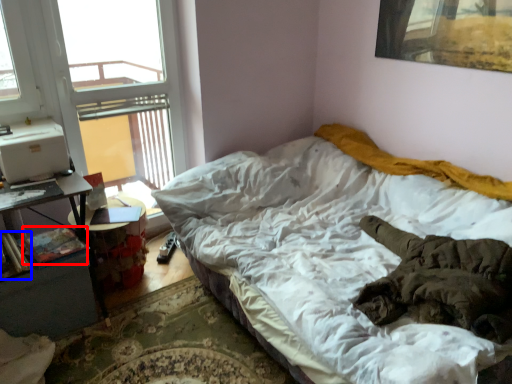
Question: Which point is closer to the camera, book (highlighted by a red box) or book (highlighted by a blue box)?

Choices:
 (A) book
 (B) book

Answer: (B)